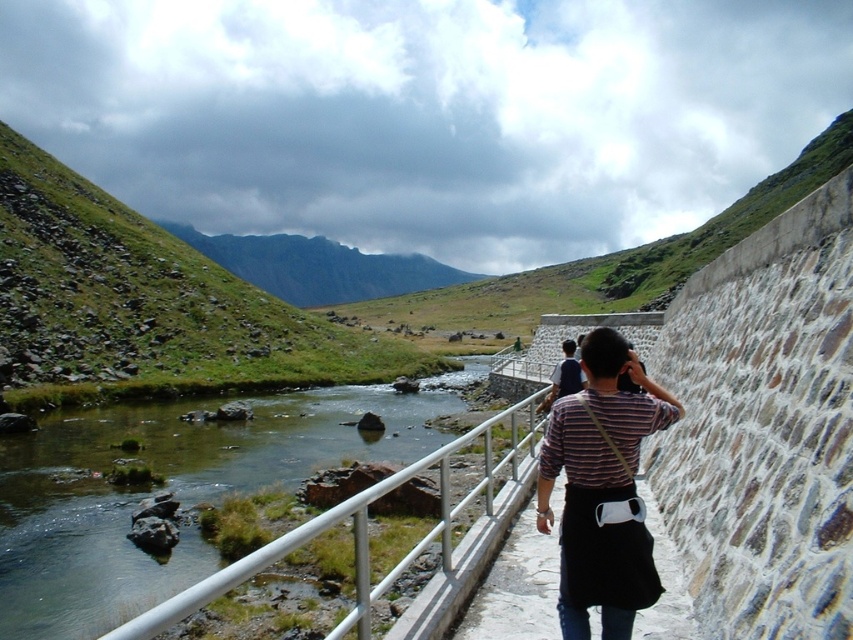
Is striped fabric shirt at center taller than white metal railing at lower center?

In fact, striped fabric shirt at center may be shorter than white metal railing at lower center.

Between striped fabric shirt at center and white metal railing at lower center, which one appears on the right side from the viewer's perspective?

striped fabric shirt at center is more to the right.

Between point (612, 497) and point (318, 532), which one is positioned behind?

The point (612, 497) is behind.

The image size is (853, 640). Find the location of `striped fabric shirt at center`. striped fabric shirt at center is located at coordinates (602, 488).